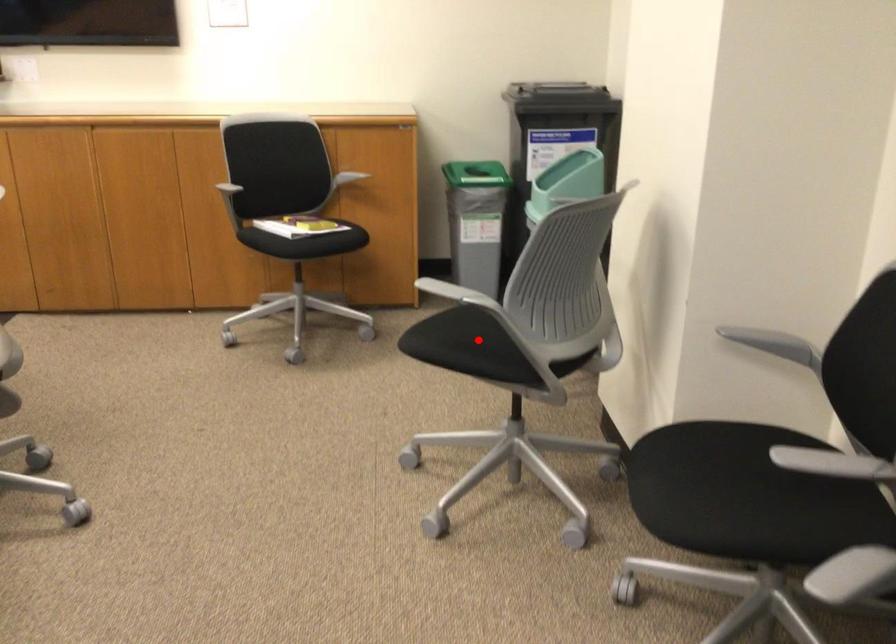
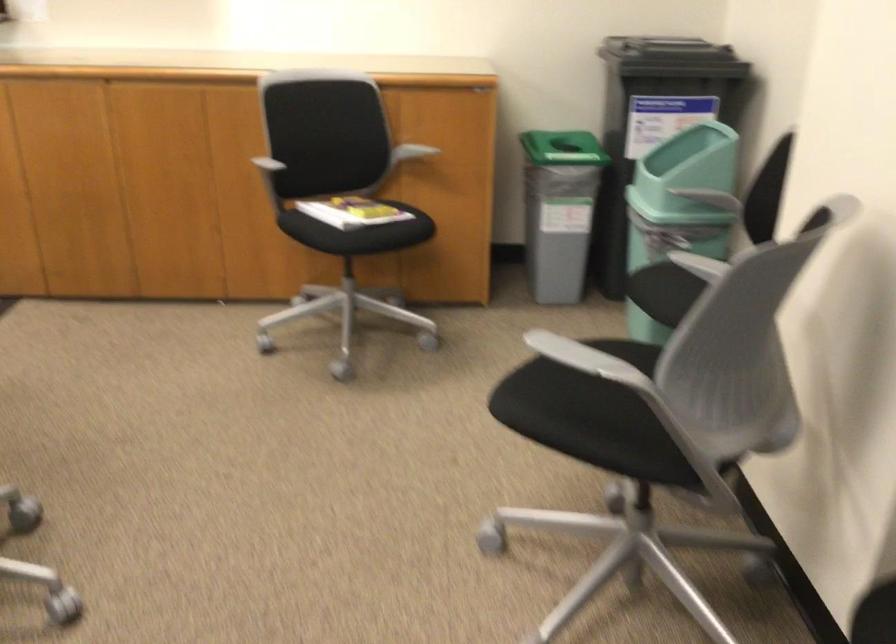
Find the pixel in the second image that matches the highlighted location in the first image.

(599, 406)